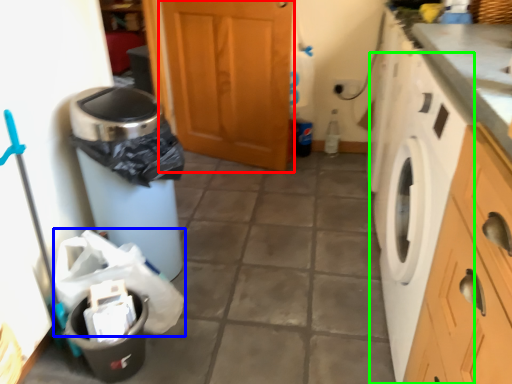
Question: Estimate the real-world distances between objects in this image. Which object is closer to screen door (highlighted by a red box), material (highlighted by a blue box) or washing machine (highlighted by a green box)?

Choices:
 (A) material
 (B) washing machine

Answer: (B)